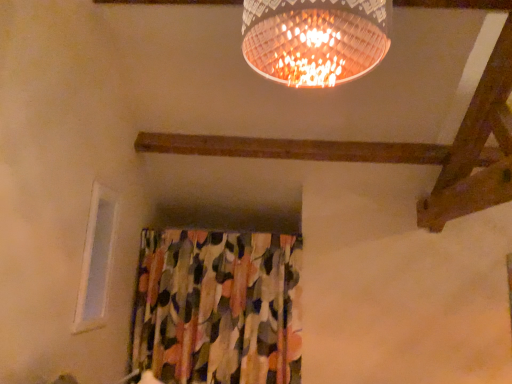
Question: Is point (92, 321) positioned closer to the camera than point (289, 259)?

Choices:
 (A) farther
 (B) closer

Answer: (B)

Question: Looking at their shapes, would you say white plastic window at upper left is wider or thinner than textured floral fabric at center?

Choices:
 (A) thin
 (B) wide

Answer: (A)

Question: From a real-world perspective, is white plastic window at upper left positioned above or below textured floral fabric at center?

Choices:
 (A) above
 (B) below

Answer: (A)

Question: In the image, is textured floral fabric at center on the left side or the right side of white plastic window at upper left?

Choices:
 (A) right
 (B) left

Answer: (A)

Question: Is textured floral fabric at center spatially inside white plastic window at upper left, or outside of it?

Choices:
 (A) outside
 (B) inside

Answer: (A)

Question: From the image's perspective, is textured floral fabric at center located above or below white plastic window at upper left?

Choices:
 (A) above
 (B) below

Answer: (B)

Question: In terms of height, does textured floral fabric at center look taller or shorter compared to white plastic window at upper left?

Choices:
 (A) short
 (B) tall

Answer: (B)